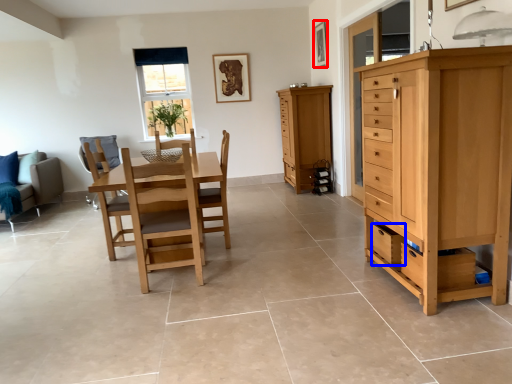
Question: Among these objects, which one is farthest to the camera, picture frame (highlighted by a red box) or drawer (highlighted by a blue box)?

Choices:
 (A) picture frame
 (B) drawer

Answer: (A)